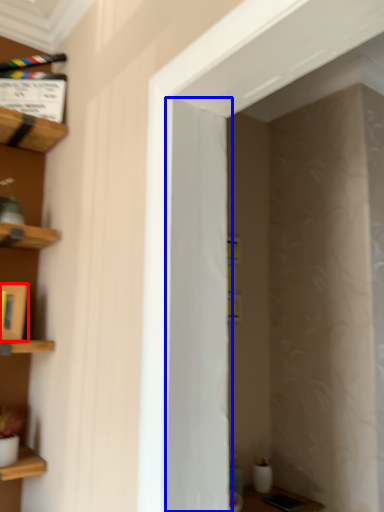
Question: Which point is closer to the camera, cabinet (highlighted by a red box) or door (highlighted by a blue box)?

Choices:
 (A) cabinet
 (B) door

Answer: (B)